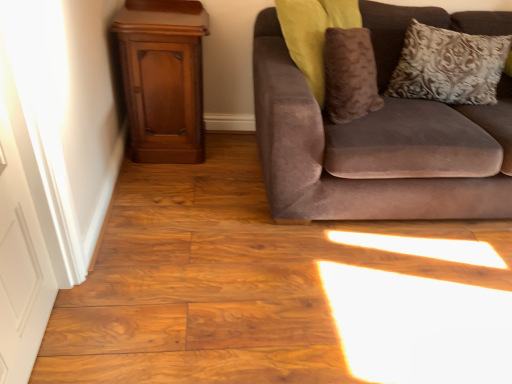
This screenshot has width=512, height=384. What do you see at coordinates (376, 150) in the screenshot?
I see `suede couch at right` at bounding box center [376, 150].

Image resolution: width=512 pixels, height=384 pixels. What do you see at coordinates (20, 266) in the screenshot?
I see `white painted wood door at left` at bounding box center [20, 266].

Locate an element on the screen. Image resolution: width=512 pixels, height=384 pixels. suede couch at right is located at coordinates (376, 150).

Is white painted wood door at left in front of or behind mahogany wood dresser at left in the image?

white painted wood door at left is in front of mahogany wood dresser at left.

Based on the photo, from the image's perspective, is white painted wood door at left under mahogany wood dresser at left?

Indeed, from the image's perspective, white painted wood door at left is shown beneath mahogany wood dresser at left.

How much distance is there between white painted wood door at left and mahogany wood dresser at left?

A distance of 3.37 feet exists between white painted wood door at left and mahogany wood dresser at left.

Considering the relative sizes of white painted wood door at left and mahogany wood dresser at left in the image provided, is white painted wood door at left shorter than mahogany wood dresser at left?

No, white painted wood door at left is not shorter than mahogany wood dresser at left.

Would you say mahogany wood dresser at left is to the left or to the right of white painted wood door at left in the picture?

mahogany wood dresser at left is to the right of white painted wood door at left.

From the image's perspective, which one is positioned lower, mahogany wood dresser at left or white painted wood door at left?

white painted wood door at left.

Is mahogany wood dresser at left inside or outside of white painted wood door at left?

mahogany wood dresser at left cannot be found inside white painted wood door at left.

Is silver textured pillow at upper right looking in the opposite direction of suede couch at right?

Yes, silver textured pillow at upper right is positioned with its back facing suede couch at right.

Consider the image. From the image's perspective, is silver textured pillow at upper right positioned above or below suede couch at right?

Based on their image positions, silver textured pillow at upper right is located above suede couch at right.

In the scene shown: Which of these two, silver textured pillow at upper right or suede couch at right, is bigger?

Bigger between the two is suede couch at right.

Is white painted wood door at left facing towards suede couch at right?

No, white painted wood door at left is not oriented towards suede couch at right.

Choose the correct answer: Is white painted wood door at left inside suede couch at right or outside it?

white painted wood door at left is not inside suede couch at right, it's outside.

Is mahogany wood dresser at left far away from silver textured pillow at upper right?

Absolutely, mahogany wood dresser at left is distant from silver textured pillow at upper right.

Is mahogany wood dresser at left situated inside silver textured pillow at upper right or outside?

mahogany wood dresser at left lies outside silver textured pillow at upper right.

Between mahogany wood dresser at left and silver textured pillow at upper right, which one has smaller width?

silver textured pillow at upper right.

Consider the image. From the image's perspective, would you say mahogany wood dresser at left is positioned over silver textured pillow at upper right?

Incorrect, from the image's perspective, mahogany wood dresser at left is lower than silver textured pillow at upper right.

Who is more distant, suede couch at right or silver textured pillow at upper right?

silver textured pillow at upper right is more distant.

Considering the positions of point (459, 209) and point (476, 43), is point (459, 209) closer or farther from the camera than point (476, 43)?

Clearly, point (459, 209) is closer to the camera than point (476, 43).

From a real-world perspective, is suede couch at right positioned above or below silver textured pillow at upper right?

Clearly, from a real-world perspective, suede couch at right is below silver textured pillow at upper right.

Considering the relative sizes of silver textured pillow at upper right and white painted wood door at left in the image provided, is silver textured pillow at upper right shorter than white painted wood door at left?

Yes.

From the image's perspective, would you say silver textured pillow at upper right is positioned over white painted wood door at left?

Yes, from the image's perspective, silver textured pillow at upper right is over white painted wood door at left.

From the picture: From a real-world perspective, which object rests below the other?

In real-world perspective, white painted wood door at left is lower.

Can you confirm if silver textured pillow at upper right is positioned to the right of white painted wood door at left?

Indeed, silver textured pillow at upper right is positioned on the right side of white painted wood door at left.

Identify the location of dresser that appears on the right of white painted wood door at left. Image resolution: width=512 pixels, height=384 pixels. (163, 78).

At what (x,y) coordinates should I click in order to perform the action: click on door located below the mahogany wood dresser at left (from the image's perspective). Please return your answer as a coordinate pair (x, y). The width and height of the screenshot is (512, 384). Looking at the image, I should click on (20, 266).

Looking at the image, which one is located closer to silver textured pillow at upper right, suede couch at right or mahogany wood dresser at left?

suede couch at right is positioned closer to the anchor silver textured pillow at upper right.

From the image, which object appears to be nearer to mahogany wood dresser at left, suede couch at right or white painted wood door at left?

suede couch at right is positioned closer to the anchor mahogany wood dresser at left.

When comparing their distances from white painted wood door at left, does silver textured pillow at upper right or suede couch at right seem closer?

suede couch at right is positioned closer to the anchor white painted wood door at left.

From the image, which object appears to be nearer to silver textured pillow at upper right, mahogany wood dresser at left or white painted wood door at left?

mahogany wood dresser at left.

Considering their positions, is white painted wood door at left positioned further to suede couch at right than silver textured pillow at upper right?

white painted wood door at left lies further to suede couch at right than the other object.

Looking at the image, which one is located closer to white painted wood door at left, suede couch at right or mahogany wood dresser at left?

mahogany wood dresser at left is closer to white painted wood door at left.

Considering their positions, is white painted wood door at left positioned further to mahogany wood dresser at left than silver textured pillow at upper right?

silver textured pillow at upper right is positioned further to the anchor mahogany wood dresser at left.

Which object lies further to the anchor point mahogany wood dresser at left, silver textured pillow at upper right or suede couch at right?

silver textured pillow at upper right.

The width and height of the screenshot is (512, 384). In order to click on dresser situated between white painted wood door at left and silver textured pillow at upper right from left to right in this screenshot , I will do `click(163, 78)`.

Locate an element on the screen. The image size is (512, 384). studio couch between mahogany wood dresser at left and silver textured pillow at upper right from left to right is located at coordinates (376, 150).

This screenshot has width=512, height=384. I want to click on studio couch situated between white painted wood door at left and silver textured pillow at upper right from left to right, so click(x=376, y=150).

You are a GUI agent. You are given a task and a screenshot of the screen. Output one action in this format:
    pyautogui.click(x=<x>, y=<y>)
    Task: Click on the dresser between white painted wood door at left and suede couch at right
    This screenshot has width=512, height=384.
    Given the screenshot: What is the action you would take?
    [163, 78]